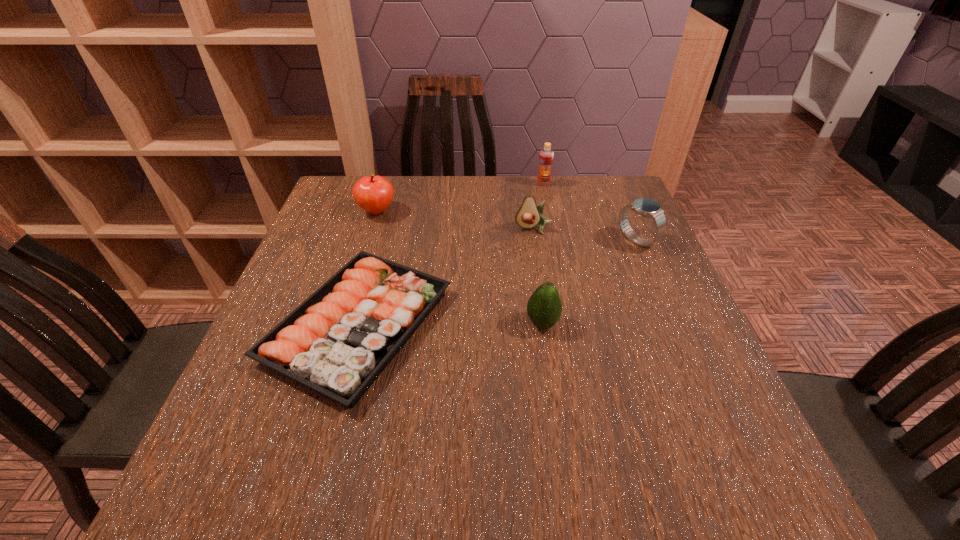
Where is `blank space located on the left of the nearer avocado`? blank space located on the left of the nearer avocado is located at coordinates point(382,323).

Find the location of `free space located 0.100m on the back of the platter`. free space located 0.100m on the back of the platter is located at coordinates (383, 236).

Where is `orange juice present at the far edge`? This screenshot has height=540, width=960. orange juice present at the far edge is located at coordinates (546, 156).

Find the location of a particular element. This screenshot has width=960, height=540. apple that is at the far edge is located at coordinates (373, 194).

The width and height of the screenshot is (960, 540). Find the location of `apple that is at the left edge`. apple that is at the left edge is located at coordinates (373, 194).

Where is `platter present at the left edge`? platter present at the left edge is located at coordinates (337, 342).

At what (x,y) coordinates should I click in order to perform the action: click on object at the right edge. Please return your answer as a coordinate pair (x, y). Looking at the image, I should click on (645, 207).

Where is `object that is at the far left corner`? The width and height of the screenshot is (960, 540). object that is at the far left corner is located at coordinates tap(373, 194).

In the image, there is a desktop. Where is `blank space at the far edge`? The width and height of the screenshot is (960, 540). blank space at the far edge is located at coordinates (532, 192).

Identify the location of vacant space at the left edge of the desktop. (329, 251).